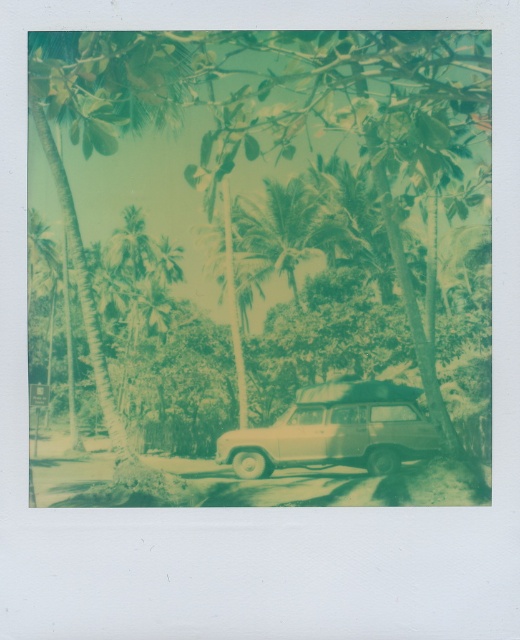
Can you confirm if green leafy tree at center is positioned below green leafy palm tree at center?

Indeed, green leafy tree at center is positioned under green leafy palm tree at center.

Find the location of a particular element. green leafy tree at center is located at coordinates (258, 257).

Who is shorter, beige matte suv at center or green leafy palm tree at center?

beige matte suv at center

Which is in front, point (362, 426) or point (291, 241)?

Point (362, 426) is more forward.

Does point (258, 433) lie in front of point (268, 234)?

Yes.

Find the location of a particular element. This screenshot has width=520, height=640. beige matte suv at center is located at coordinates (335, 432).

Can you confirm if green leafy tree at center is shorter than beige matte suv at center?

Incorrect, green leafy tree at center's height does not fall short of beige matte suv at center's.

Which is more to the right, green leafy tree at center or beige matte suv at center?

beige matte suv at center is more to the right.

What do you see at coordinates (258, 257) in the screenshot?
I see `green leafy tree at center` at bounding box center [258, 257].

This screenshot has width=520, height=640. In order to click on green leafy tree at center in this screenshot , I will do `click(258, 257)`.